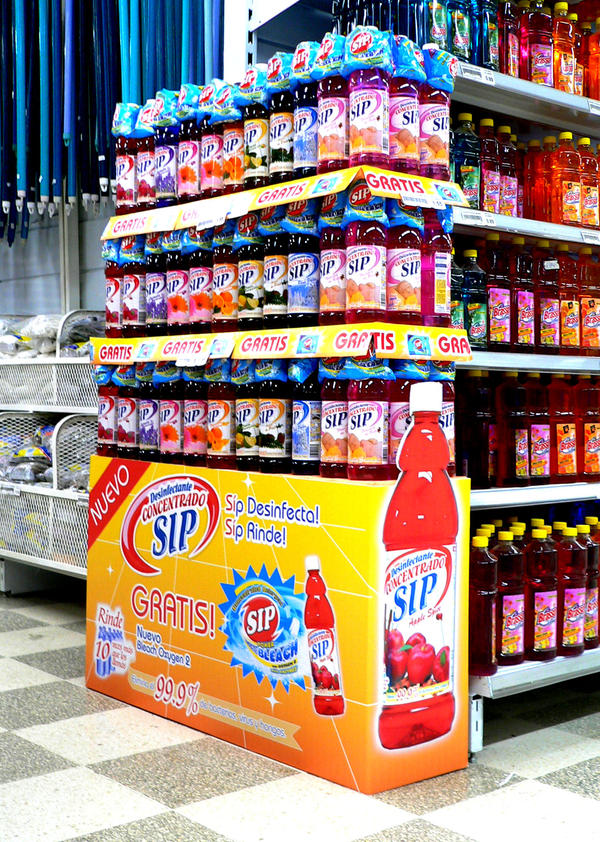
Find the location of a particular element. black and white square flooring is located at coordinates (274, 830), (208, 766), (500, 782), (535, 816), (31, 707).